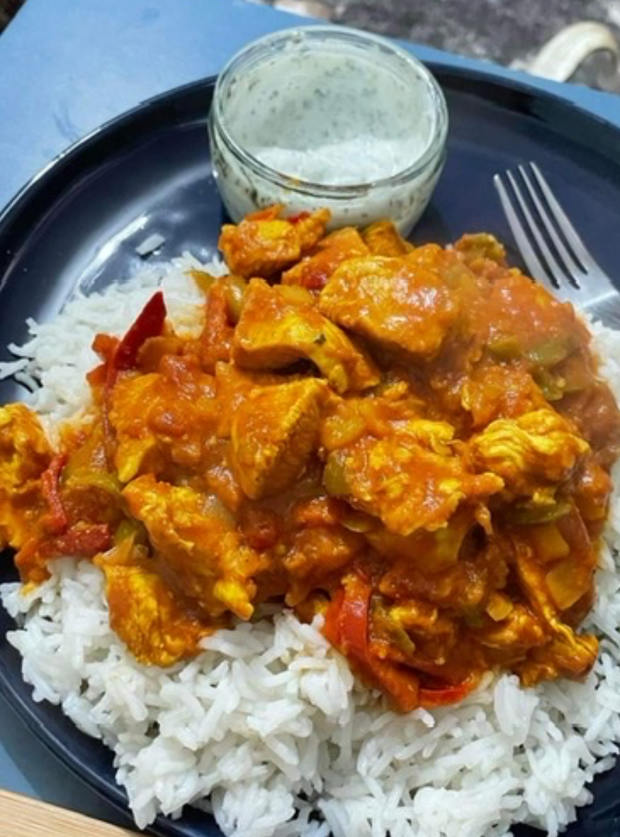
You are a GUI agent. You are given a task and a screenshot of the screen. Output one action in this format:
    pyautogui.click(x=<x>, y=<y>)
    Task: Click on the dining plate
    This screenshot has height=837, width=620.
    Given the screenshot: What is the action you would take?
    pyautogui.click(x=179, y=198)